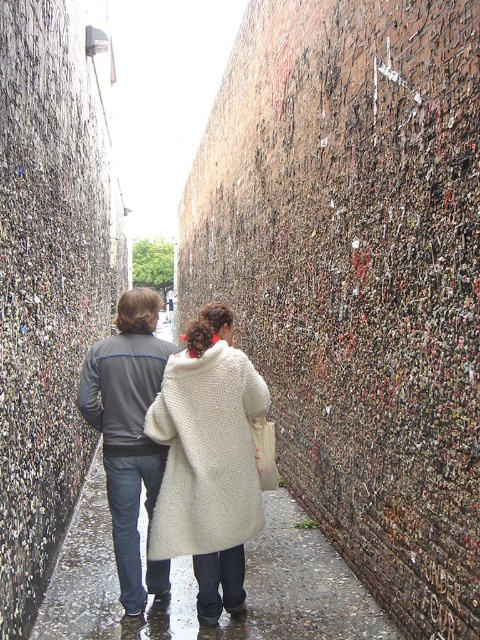
Consider the image. You are a delivery person with a 4 feet wide cart. You need to navigate through the narrow alleyway between the wet asphalt sidewalk at center and the white fuzzy coat at center. Can your cart fit through the space between them?

The wet asphalt sidewalk at center and the white fuzzy coat at center are 3.88 feet apart, so the cart which is 4 feet wide cannot fit through the space between them.

You are a pedestrian trying to walk through the narrow alleyway. You see the wet asphalt sidewalk at center and the gray fabric jacket at center. Which object is closer to your right side?

The wet asphalt sidewalk at center is to the right of gray fabric jacket at center, so the wet asphalt sidewalk at center is closer to your right side.

You are a photographer trying to capture both the gray fabric jacket at center and the white fabric shopping bag at center in a single shot. Based on their positions, which object should you focus on first to ensure both are in frame?

The gray fabric jacket at center is to the left of the white fabric shopping bag at center, so you should focus on the white fabric shopping bag at center first to ensure both are in frame.